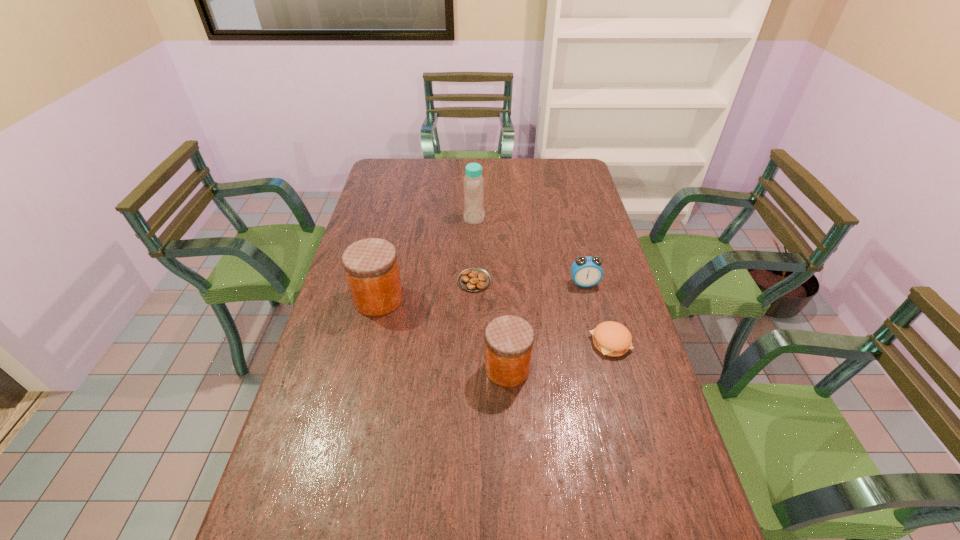
Identify the location of free location located 0.240m on the front of the nearer jar. This screenshot has width=960, height=540. (514, 481).

What are the coordinates of `vacant space located on the face of the fourth tallest object` in the screenshot? It's located at (600, 347).

Image resolution: width=960 pixels, height=540 pixels. Identify the location of blank space located 0.150m on the left of the tallest object. (425, 218).

Locate an element on the screen. The image size is (960, 540). vacant space located 0.160m on the left of the patty is located at coordinates (534, 342).

At what (x,y) coordinates should I click in order to perform the action: click on free space located 0.100m on the left of the pastry. Please return your answer as a coordinate pair (x, y). Looking at the image, I should click on (427, 281).

You are a GUI agent. You are given a task and a screenshot of the screen. Output one action in this format:
    pyautogui.click(x=<x>, y=<y>)
    Task: Click on the object located in the left edge section of the desktop
    
    Given the screenshot: What is the action you would take?
    pyautogui.click(x=371, y=267)

The height and width of the screenshot is (540, 960). Identify the location of alarm clock that is at the right edge. (587, 271).

I want to click on patty present at the right edge, so click(x=611, y=338).

Find the location of `free region at the far edge of the desktop`. free region at the far edge of the desktop is located at coordinates (494, 167).

In the image, there is a desktop. Where is `free space at the near edge`? The image size is (960, 540). free space at the near edge is located at coordinates (612, 522).